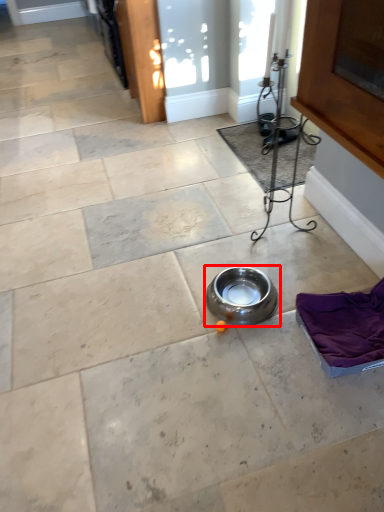
Question: From the image's perspective, considering the relative positions of bowl (annotated by the red box) and mat in the image provided, where is bowl (annotated by the red box) located with respect to the staircase?

Choices:
 (A) above
 (B) below

Answer: (B)